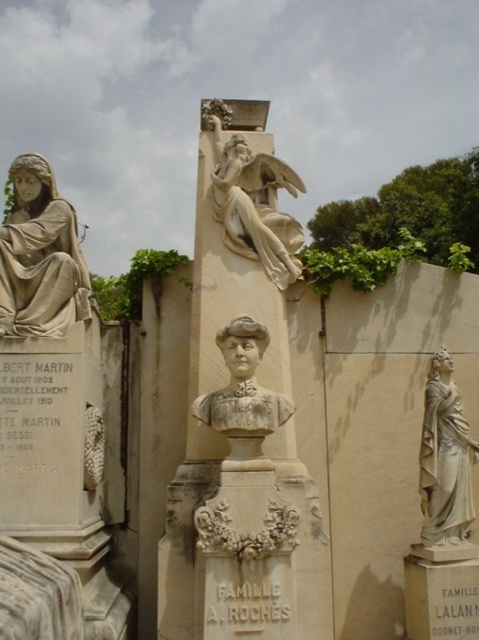
Question: Which object appears farthest from the camera in this image?

Choices:
 (A) matte stone statue at left
 (B) white marble statue at center
 (C) matte stone bust at center

Answer: (B)

Question: Which point is farther to the camera?

Choices:
 (A) matte stone statue at left
 (B) matte stone bust at center

Answer: (A)

Question: Which point is farther from the camera taking this photo?

Choices:
 (A) pyautogui.click(x=11, y=248)
 (B) pyautogui.click(x=437, y=502)
 (C) pyautogui.click(x=250, y=360)

Answer: (A)

Question: Where is matte stone statue at left located in relation to white marble statue at right in the image?

Choices:
 (A) below
 (B) above

Answer: (B)

Question: Considering the relative positions of matte stone statue at left and matte stone bust at center in the image provided, where is matte stone statue at left located with respect to matte stone bust at center?

Choices:
 (A) right
 (B) left

Answer: (B)

Question: Can you confirm if white stone column at center is thinner than white marble statue at center?

Choices:
 (A) yes
 (B) no

Answer: (B)